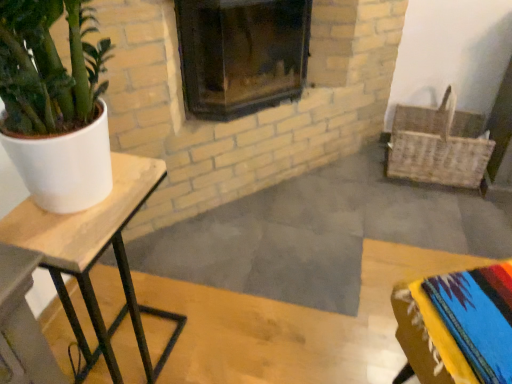
Question: Is wooden table at left at the back of woven wicker basket at right?

Choices:
 (A) yes
 (B) no

Answer: (B)

Question: Is woven wicker basket at right bigger than wooden table at left?

Choices:
 (A) no
 (B) yes

Answer: (B)

Question: Is woven wicker basket at right aimed at wooden table at left?

Choices:
 (A) no
 (B) yes

Answer: (A)

Question: Is woven wicker basket at right wider than wooden table at left?

Choices:
 (A) no
 (B) yes

Answer: (B)

Question: Can you confirm if woven wicker basket at right is positioned to the right of wooden table at left?

Choices:
 (A) yes
 (B) no

Answer: (A)

Question: Visually, is wooden table at left positioned to the left or to the right of dark glass fireplace at center?

Choices:
 (A) left
 (B) right

Answer: (A)

Question: Is wooden table at left taller or shorter than dark glass fireplace at center?

Choices:
 (A) tall
 (B) short

Answer: (A)

Question: Relative to dark glass fireplace at center, is wooden table at left in front or behind?

Choices:
 (A) front
 (B) behind

Answer: (A)

Question: From the image's perspective, is wooden table at left located above or below dark glass fireplace at center?

Choices:
 (A) below
 (B) above

Answer: (A)

Question: Is dark glass fireplace at center wider or thinner than wooden table at left?

Choices:
 (A) thin
 (B) wide

Answer: (B)

Question: From a real-world perspective, is dark glass fireplace at center above or below wooden table at left?

Choices:
 (A) above
 (B) below

Answer: (A)

Question: From the image's perspective, relative to wooden table at left, is dark glass fireplace at center above or below?

Choices:
 (A) above
 (B) below

Answer: (A)

Question: Is dark glass fireplace at center to the left or to the right of wooden table at left in the image?

Choices:
 (A) right
 (B) left

Answer: (A)

Question: Considering the positions of point (472, 119) and point (108, 206), is point (472, 119) closer or farther from the camera than point (108, 206)?

Choices:
 (A) farther
 (B) closer

Answer: (A)

Question: In the image, is woven wicker basket at right positioned in front of or behind wooden table at left?

Choices:
 (A) behind
 (B) front

Answer: (A)